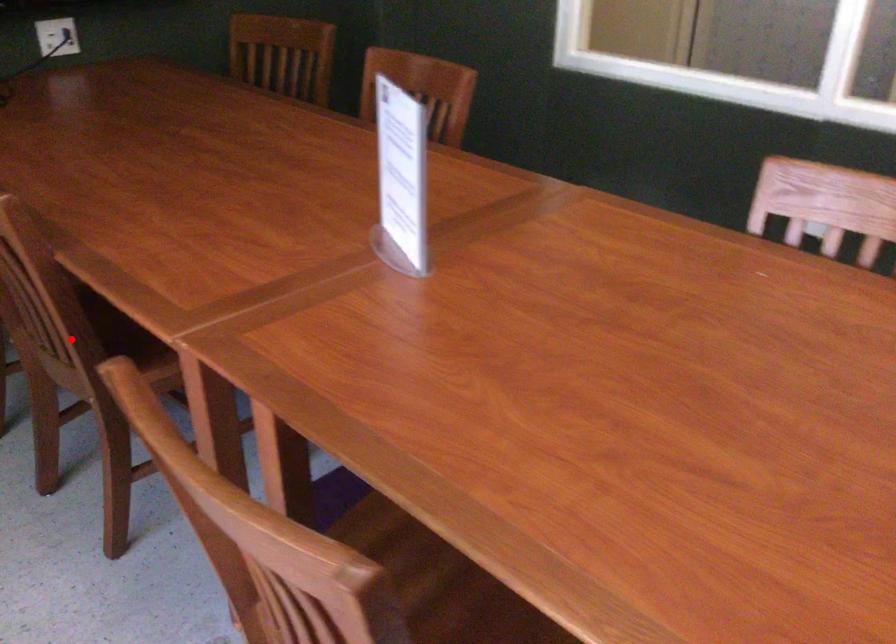
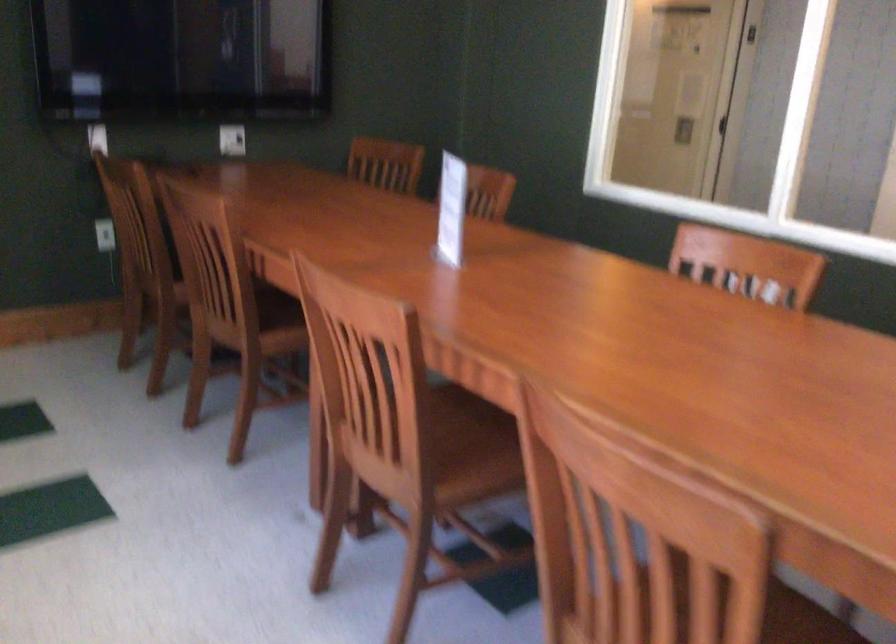
Question: I am providing you with two images of the same scene from different viewpoints. In image1, a red point is highlighted. Considering the same 3D point in image2, which of the following is correct?

Choices:
 (A) It is closer
 (B) It is farther

Answer: (B)